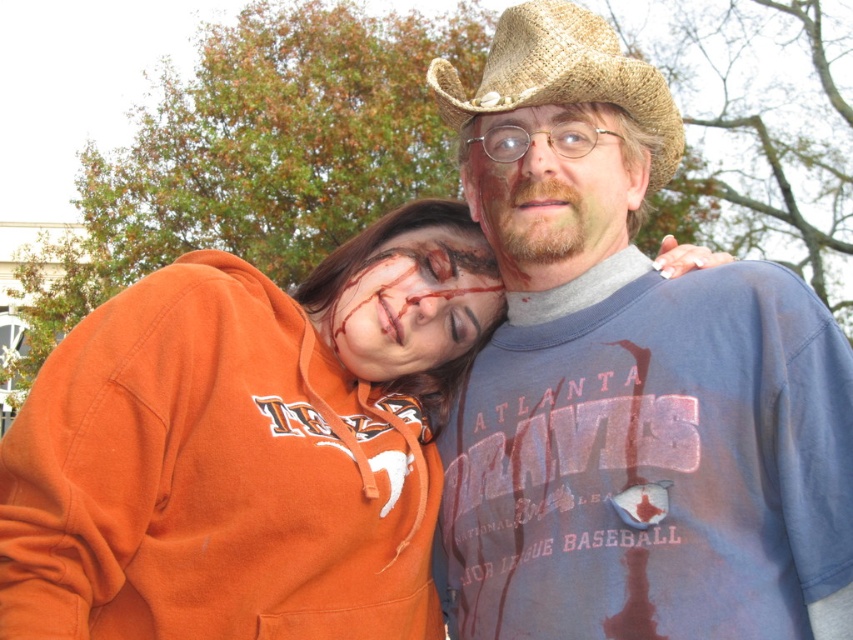
You are a photographer standing at the center of the scene. You want to take a photo of both the orange fleece hoodie at center and the matte brown cowboy hat at center. Since your camera can only focus on objects within 5 meters, will both subjects be in focus?

The orange fleece hoodie at center is 4.88 meters away from matte brown cowboy hat at center. Since the distance between them is within the 5 meters focus range, both subjects will be in focus.